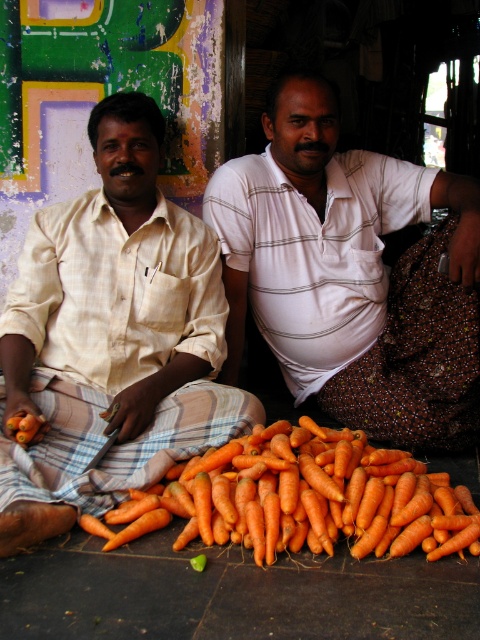
Who is taller, white striped shirt at center or orange matte carrots at lower center?

white striped shirt at center

Can you confirm if white striped shirt at center is thinner than orange matte carrots at lower center?

Correct, white striped shirt at center's width is less than orange matte carrots at lower center's.

Locate an element on the screen. The image size is (480, 640). white striped shirt at center is located at coordinates (350, 273).

The width and height of the screenshot is (480, 640). I want to click on white striped shirt at center, so click(350, 273).

Does white striped shirt at center lie behind brown textured cloth at lower right?

No, it is in front of brown textured cloth at lower right.

Which is more to the left, white striped shirt at center or brown textured cloth at lower right?

white striped shirt at center is more to the left.

Locate an element on the screen. white striped shirt at center is located at coordinates 350,273.

I want to click on white striped shirt at center, so click(x=350, y=273).

Looking at this image, does light beige fabric shirt at left have a lesser width compared to brown textured cloth at lower right?

In fact, light beige fabric shirt at left might be wider than brown textured cloth at lower right.

Does light beige fabric shirt at left have a greater width compared to brown textured cloth at lower right?

Indeed, light beige fabric shirt at left has a greater width compared to brown textured cloth at lower right.

Image resolution: width=480 pixels, height=640 pixels. I want to click on light beige fabric shirt at left, so click(x=111, y=337).